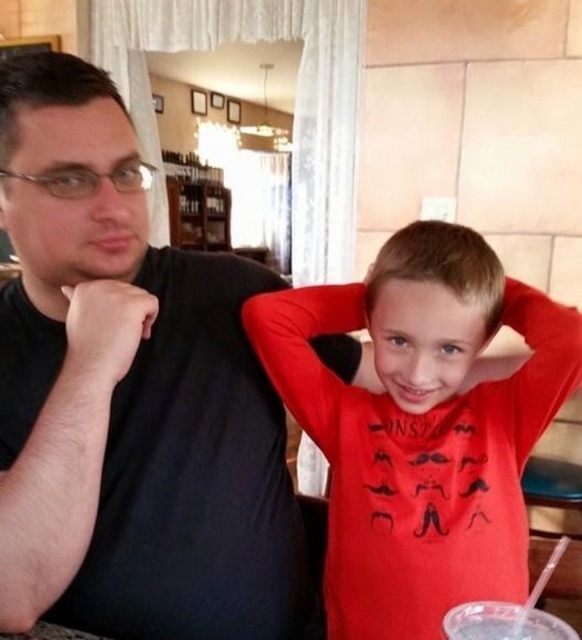
Question: Is the position of red matte shirt at right less distant than that of clear plastic cup at lower right?

Choices:
 (A) no
 (B) yes

Answer: (A)

Question: Which point is closer to the camera?

Choices:
 (A) black matte shirt at left
 (B) clear plastic cup at lower right

Answer: (B)

Question: Does red matte shirt at right lie behind clear plastic cup at lower right?

Choices:
 (A) yes
 (B) no

Answer: (A)

Question: Based on their relative distances, which object is farther from the clear plastic cup at lower right?

Choices:
 (A) black matte shirt at left
 (B) red matte shirt at right

Answer: (A)

Question: Among these points, which one is nearest to the camera?

Choices:
 (A) (519, 612)
 (B) (395, 445)
 (C) (179, 396)

Answer: (A)

Question: Observing the image, what is the correct spatial positioning of black matte shirt at left in reference to red matte shirt at right?

Choices:
 (A) right
 (B) left

Answer: (B)